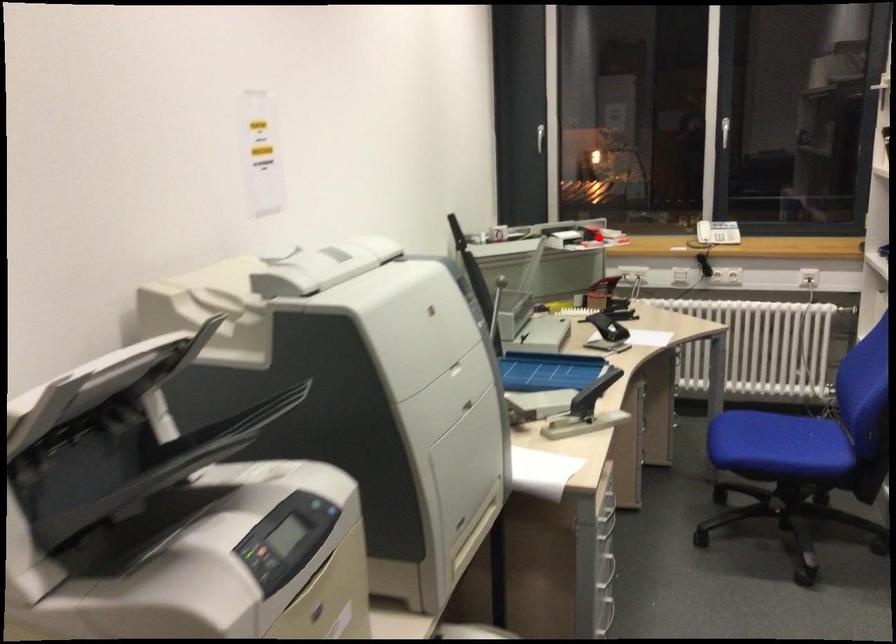
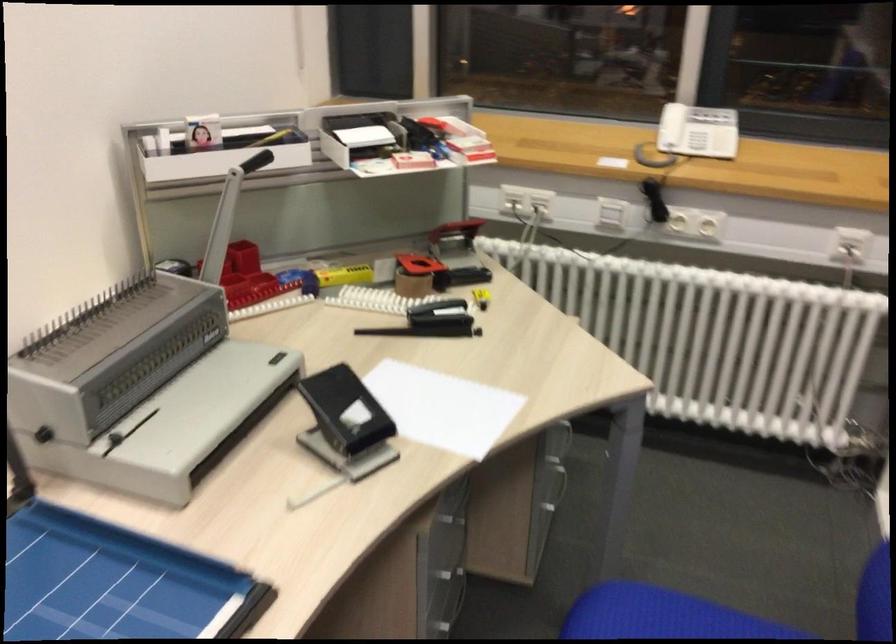
The point at the highlighted location is marked in the first image. Where is the corresponding point in the second image?

(421, 160)